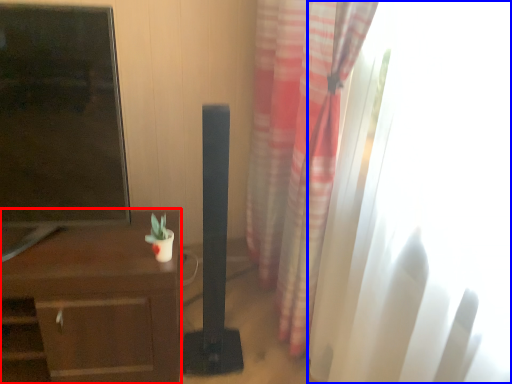
Question: Which object is further to the camera taking this photo, desk (highlighted by a red box) or window (highlighted by a blue box)?

Choices:
 (A) desk
 (B) window

Answer: (A)